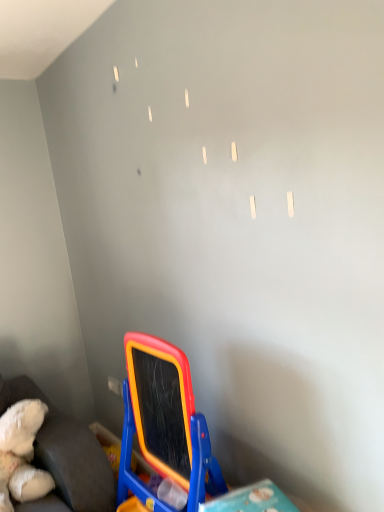
Question: Looking at their shapes, would you say rubberized plastic easel at lower center is wider or thinner than white plush teddy bear at lower left?

Choices:
 (A) thin
 (B) wide

Answer: (A)

Question: Does point (153, 388) appear closer or farther from the camera than point (62, 480)?

Choices:
 (A) farther
 (B) closer

Answer: (B)

Question: Is rubberized plastic easel at lower center taller or shorter than white plush teddy bear at lower left?

Choices:
 (A) short
 (B) tall

Answer: (B)

Question: Considering the positions of white plush teddy bear at lower left and rubberized plastic easel at lower center in the image, is white plush teddy bear at lower left wider or thinner than rubberized plastic easel at lower center?

Choices:
 (A) wide
 (B) thin

Answer: (A)

Question: Is white plush teddy bear at lower left spatially inside rubberized plastic easel at lower center, or outside of it?

Choices:
 (A) outside
 (B) inside

Answer: (A)

Question: Considering the positions of white plush teddy bear at lower left and rubberized plastic easel at lower center in the image, is white plush teddy bear at lower left bigger or smaller than rubberized plastic easel at lower center?

Choices:
 (A) big
 (B) small

Answer: (B)

Question: Considering their positions, is white plush teddy bear at lower left located in front of or behind rubberized plastic easel at lower center?

Choices:
 (A) front
 (B) behind

Answer: (B)